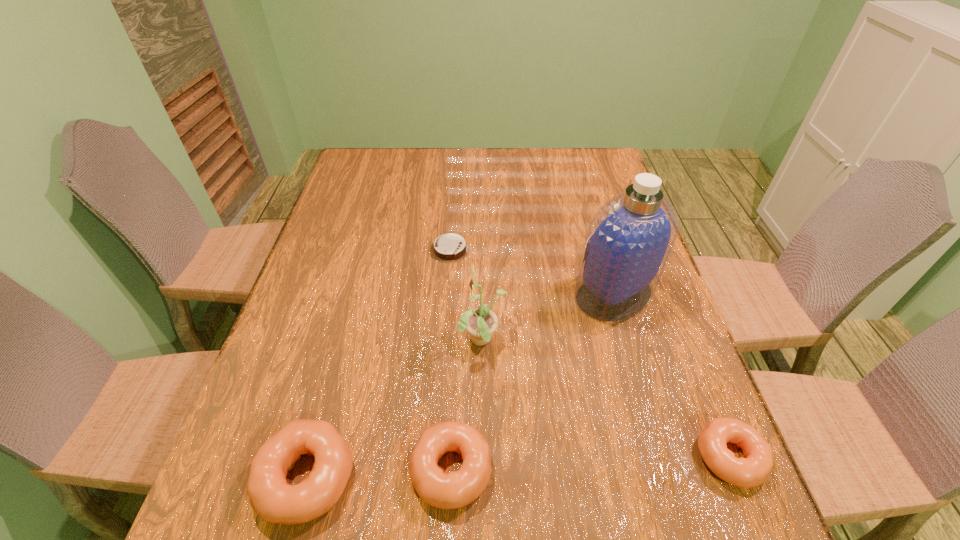
This screenshot has height=540, width=960. I want to click on object present at the near left corner, so click(271, 497).

Where is `object positioned at the near right corner`? object positioned at the near right corner is located at coordinates (751, 471).

The height and width of the screenshot is (540, 960). Identify the location of vacant space at the far edge of the desktop. (522, 155).

In the image, there is a desktop. Where is `vacant space at the left edge`? vacant space at the left edge is located at coordinates (276, 360).

The width and height of the screenshot is (960, 540). What are the coordinates of `vacant space at the right edge of the desktop` in the screenshot? It's located at (586, 193).

Image resolution: width=960 pixels, height=540 pixels. Identify the location of vacant area at the far left corner. (389, 174).

Where is `free region at the far right corner of the desktop`? free region at the far right corner of the desktop is located at coordinates (584, 170).

Locate an element on the screen. unoccupied position between the tallest object and the shortest doughnut is located at coordinates (672, 375).

Identify the location of free space between the leftmost doughnut and the second tallest object. (395, 409).

In order to click on vacant space in between the fifth tallest object and the second doughnut from left to right in this screenshot , I will do `click(590, 463)`.